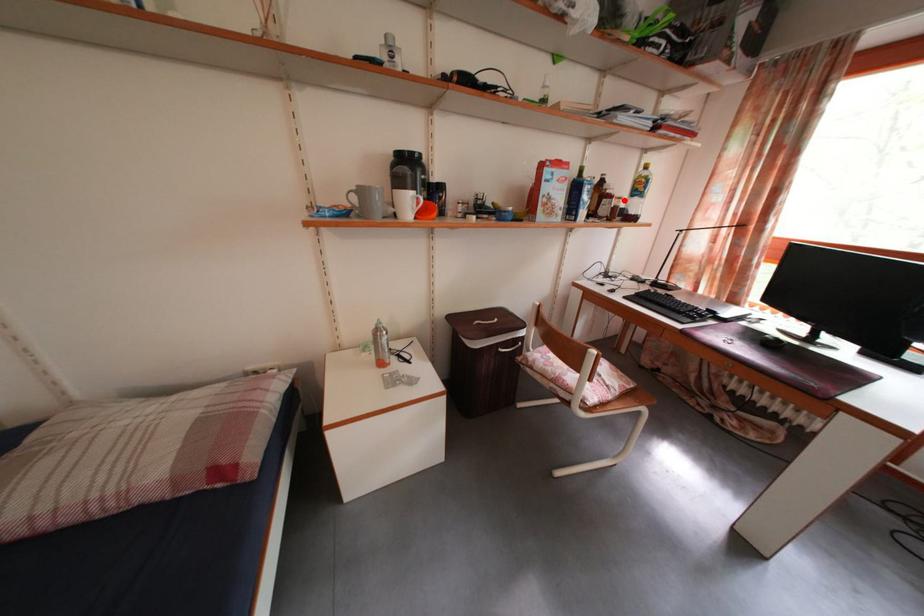
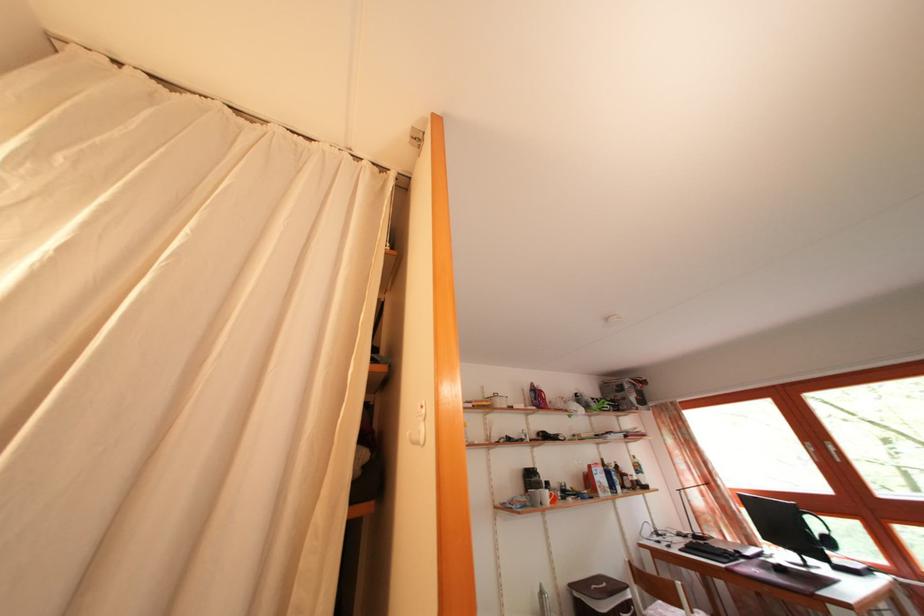
Where in the second image is the point corresponding to the highlighted location from the first image?

(636, 480)